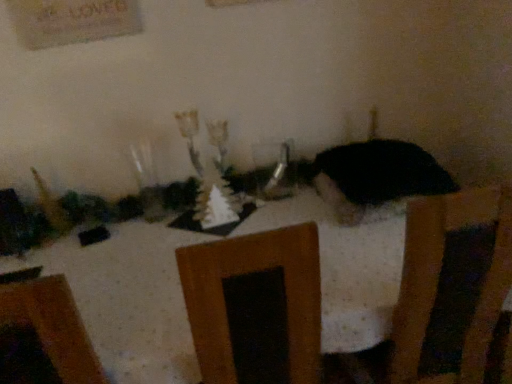
Identify the location of empty space that is in between black matte cat at center and clear glass vase at center. coord(302,211).